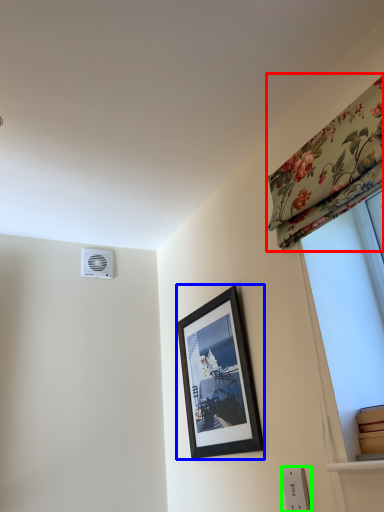
Question: Based on their relative distances, which object is farther from curtain (highlighted by a red box)? Choose from picture frame (highlighted by a blue box) and electric outlet (highlighted by a green box).

Choices:
 (A) picture frame
 (B) electric outlet

Answer: (B)